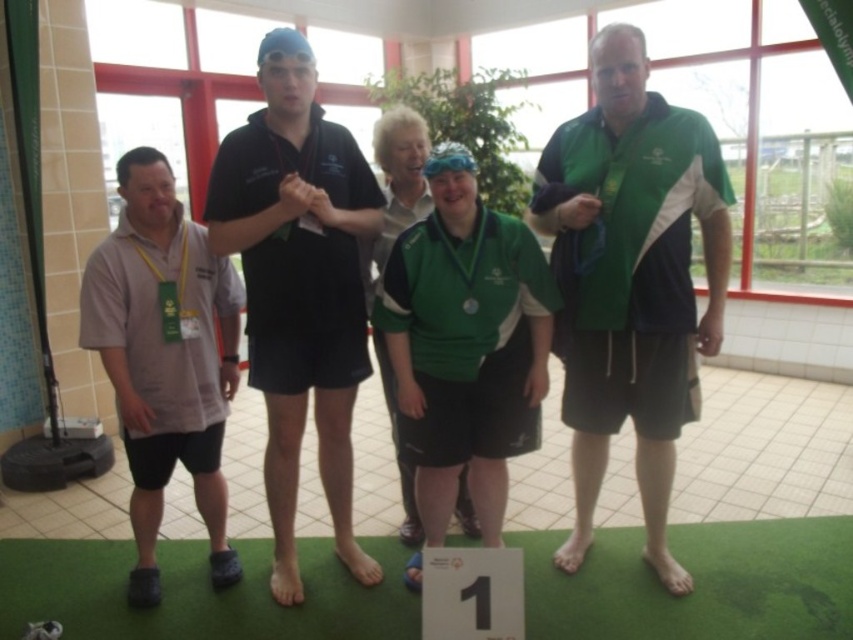
Is green fabric shirt at center below black matte shirt at center?

Actually, green fabric shirt at center is above black matte shirt at center.

Consider the image. Can you confirm if green fabric shirt at center is smaller than black matte shirt at center?

No.

Image resolution: width=853 pixels, height=640 pixels. What do you see at coordinates (631, 280) in the screenshot?
I see `green fabric shirt at center` at bounding box center [631, 280].

Locate an element on the screen. This screenshot has width=853, height=640. green fabric shirt at center is located at coordinates (631, 280).

Does black matte shirt at center have a greater width compared to gray fabric shirt at left?

Correct, the width of black matte shirt at center exceeds that of gray fabric shirt at left.

Describe the element at coordinates (299, 285) in the screenshot. I see `black matte shirt at center` at that location.

Does point (236, 237) lie behind point (131, 200)?

No, it is in front of (131, 200).

This screenshot has height=640, width=853. Find the location of `black matte shirt at center`. black matte shirt at center is located at coordinates (299, 285).

Between point (605, 337) and point (123, 195), which one is positioned behind?

Positioned behind is point (605, 337).

Does green fabric shirt at center have a greater height compared to gray fabric shirt at left?

Yes.

The width and height of the screenshot is (853, 640). Find the location of `green fabric shirt at center`. green fabric shirt at center is located at coordinates pos(631,280).